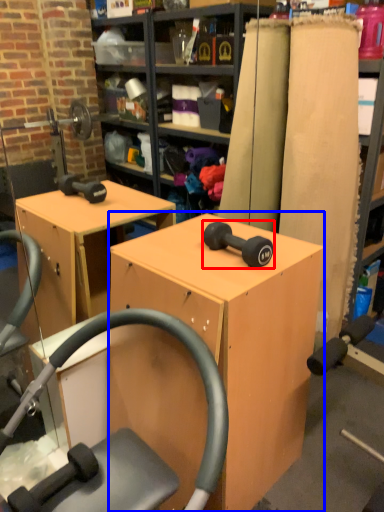
Question: Among these objects, which one is nearest to the camera, dumbbell (highlighted by a red box) or furniture (highlighted by a blue box)?

Choices:
 (A) dumbbell
 (B) furniture

Answer: (B)